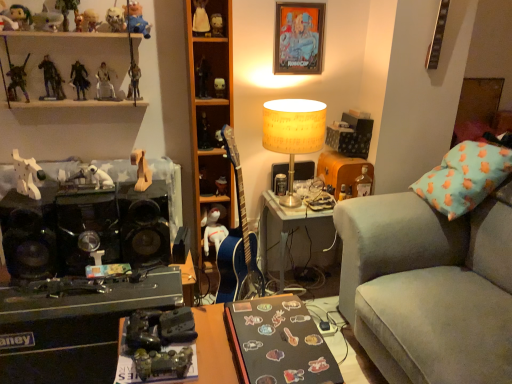
Question: Visually, is metallic silver figure at upper left, which ranks as the 11th toy in top-to-bottom order, positioned to the left or to the right of translucent glass bottle at right?

Choices:
 (A) left
 (B) right

Answer: (A)

Question: Does point (109, 96) appear closer or farther from the camera than point (355, 188)?

Choices:
 (A) farther
 (B) closer

Answer: (B)

Question: Which is nearer to the metallic gold figure at upper center, the ninth toy in the top-to-bottom sequence?

Choices:
 (A) metallic silver figure at upper left, acting as the eighth toy starting from the bottom
 (B) dark matte figure at upper left, the twelfth toy when ordered from top to bottom
 (C) wooden figurine at upper left, which is the 17th toy from bottom to top
 (D) white matte wooden dog at left, which is the 16th toy in top-to-bottom order
 (E) metallic action figure at left, positioned as the 5th toy in bottom-to-top order

Answer: (A)

Question: Which is farther from the dark matte figure at upper left, the 7th toy ordered from the bottom?

Choices:
 (A) translucent glass bottle at right
 (B) metallic poster at upper center
 (C) blue soft pillow at right
 (D) metallic silver figure at upper left, which ranks as the 11th toy in top-to-bottom order
 (E) wooden figurine at upper left, which is the 17th toy from bottom to top

Answer: (C)